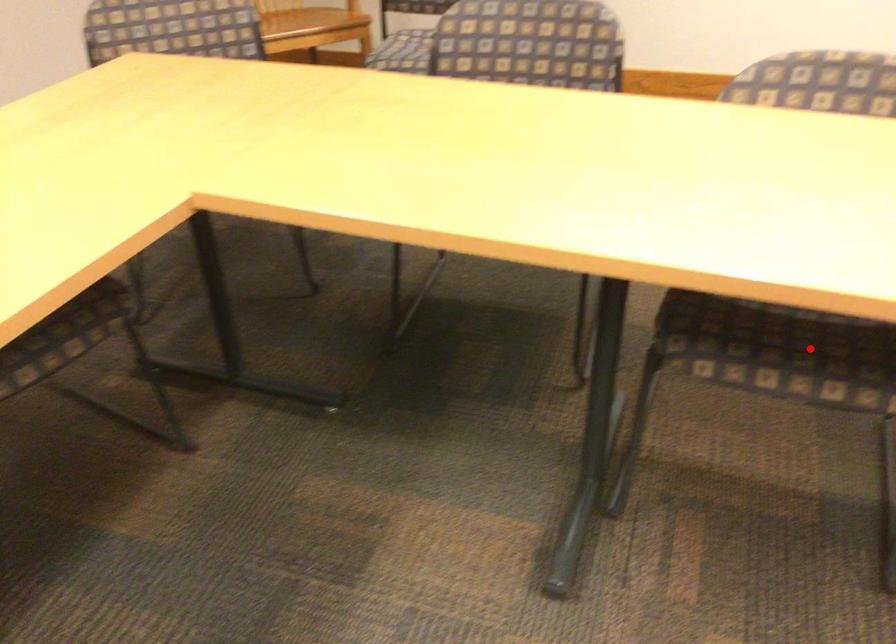
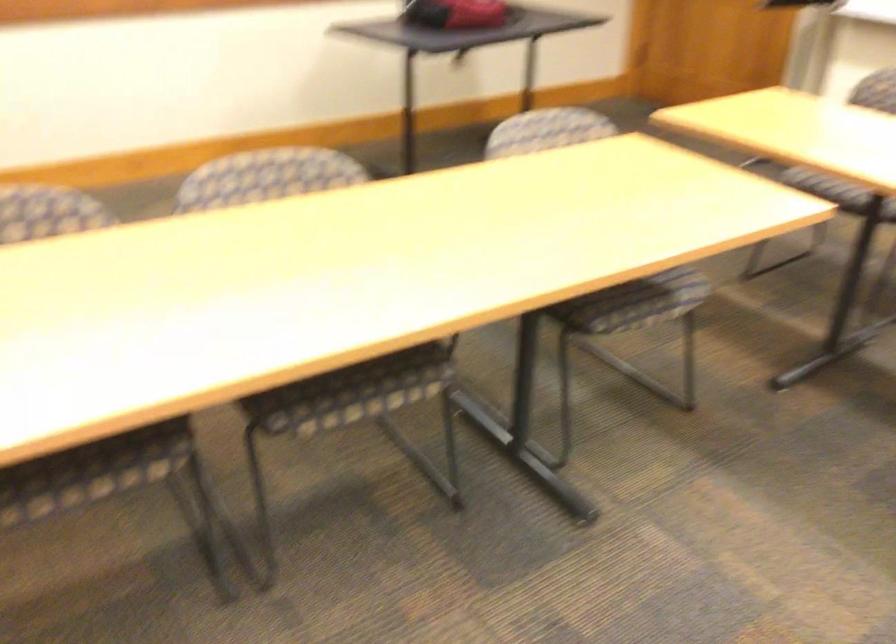
In the second image, find the point that corresponds to the highlighted location in the first image.

(92, 471)